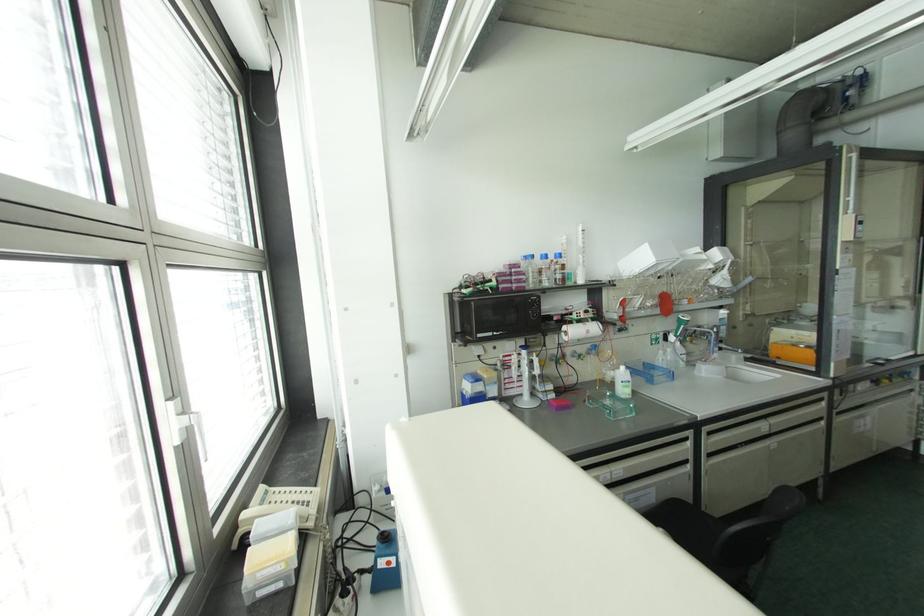
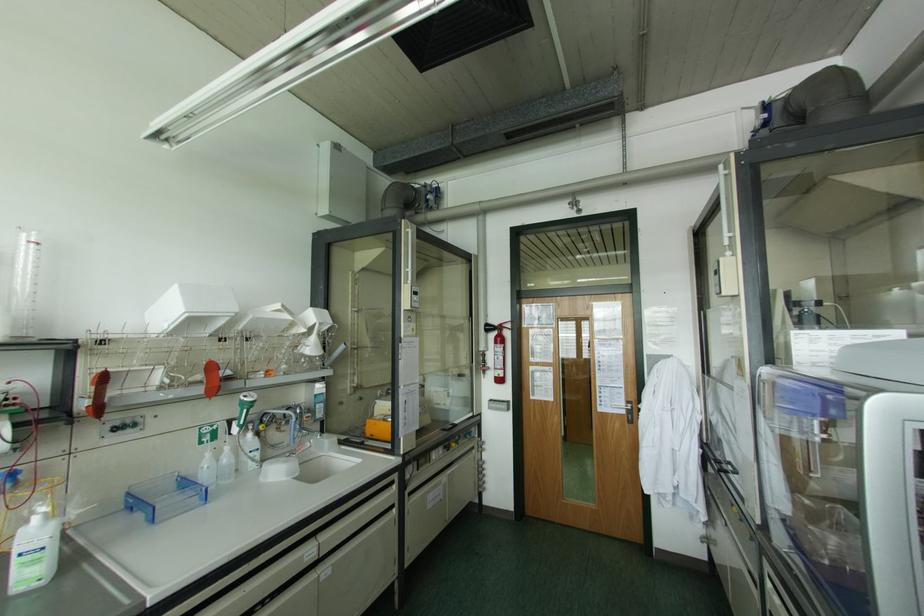
Where in the second image is the point corresponding to (x=669, y=349) from the first image?

(226, 448)